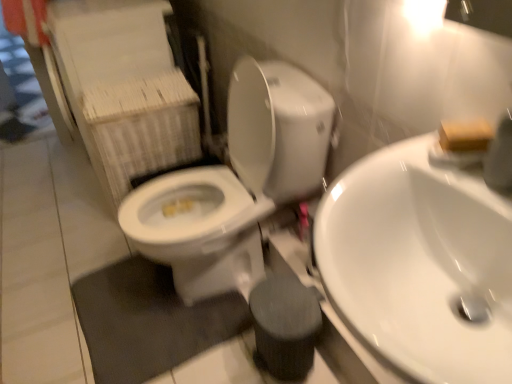
Question: Can you confirm if white glossy toilet at center is bigger than white glossy sink at center right?

Choices:
 (A) yes
 (B) no

Answer: (A)

Question: Is white glossy toilet at center oriented away from white glossy sink at center right?

Choices:
 (A) yes
 (B) no

Answer: (B)

Question: Considering the relative sizes of white glossy toilet at center and white glossy sink at center right in the image provided, is white glossy toilet at center thinner than white glossy sink at center right?

Choices:
 (A) yes
 (B) no

Answer: (B)

Question: Considering the relative sizes of white glossy toilet at center and white glossy sink at center right in the image provided, is white glossy toilet at center taller than white glossy sink at center right?

Choices:
 (A) yes
 (B) no

Answer: (A)

Question: From the image's perspective, would you say white glossy toilet at center is shown under white glossy sink at center right?

Choices:
 (A) no
 (B) yes

Answer: (A)

Question: From a real-world perspective, is white glossy toilet at center on top of white glossy sink at center right?

Choices:
 (A) no
 (B) yes

Answer: (A)

Question: From a real-world perspective, is white glossy sink at center right positioned over wooden block at upper right based on gravity?

Choices:
 (A) no
 (B) yes

Answer: (A)

Question: Is white glossy sink at center right looking in the opposite direction of wooden block at upper right?

Choices:
 (A) no
 (B) yes

Answer: (A)

Question: From the image's perspective, is white glossy sink at center right below wooden block at upper right?

Choices:
 (A) yes
 (B) no

Answer: (A)

Question: Does white glossy sink at center right appear on the right side of wooden block at upper right?

Choices:
 (A) no
 (B) yes

Answer: (A)

Question: Is white glossy sink at center right positioned far away from wooden block at upper right?

Choices:
 (A) no
 (B) yes

Answer: (A)

Question: Is white glossy sink at center right at the left side of wooden block at upper right?

Choices:
 (A) yes
 (B) no

Answer: (A)

Question: Can you confirm if wooden block at upper right is wider than white glossy sink at center right?

Choices:
 (A) no
 (B) yes

Answer: (A)